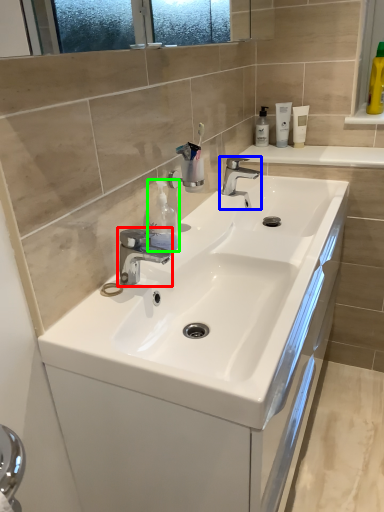
Question: Which object is the closest to the tap (highlighted by a red box)? Choose among these: tap (highlighted by a blue box) or cleaning product (highlighted by a green box).

Choices:
 (A) tap
 (B) cleaning product

Answer: (B)